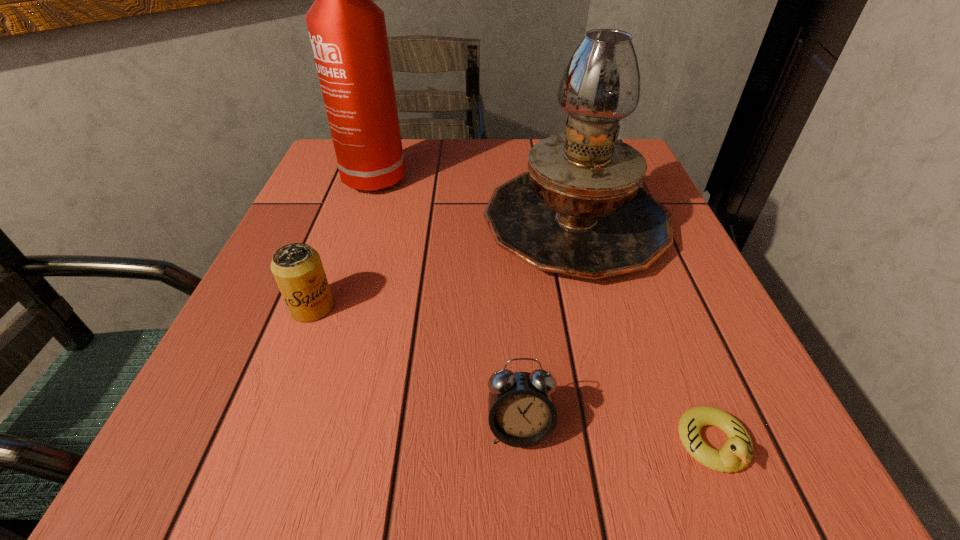
Where is `fire extinguisher`? fire extinguisher is located at coordinates (347, 30).

Where is `the second tallest object`? the second tallest object is located at coordinates (580, 210).

Identify the location of beer can. (297, 268).

This screenshot has width=960, height=540. In order to click on alarm clock in this screenshot , I will do `click(521, 412)`.

The width and height of the screenshot is (960, 540). I want to click on duckling, so 737,452.

The width and height of the screenshot is (960, 540). Find the location of `free location located at the nozzle of the tallest object`. free location located at the nozzle of the tallest object is located at coordinates (343, 273).

The image size is (960, 540). In order to click on free region located on the front of the oil lamp in this screenshot , I will do `click(623, 409)`.

Image resolution: width=960 pixels, height=540 pixels. In order to click on vacant area situated on the left of the beer can in this screenshot , I will do `click(241, 307)`.

Locate an element on the screen. This screenshot has width=960, height=540. fire extinguisher that is at the far edge is located at coordinates 347,30.

Where is `oil lamp present at the far edge`? The width and height of the screenshot is (960, 540). oil lamp present at the far edge is located at coordinates (580, 210).